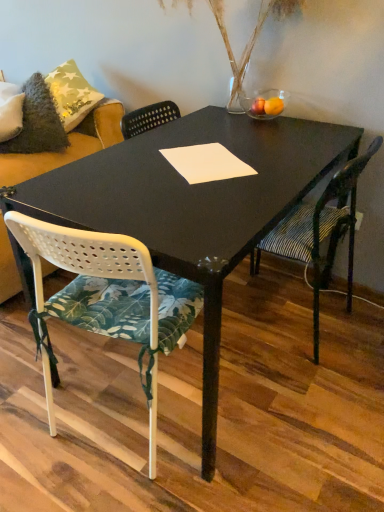
Question: Is striped fabric chair at right, which appears as the 1th chair when viewed from the right, at the right side of white perforated plastic chair at center, which is counted as the 2th chair, starting from the right?

Choices:
 (A) no
 (B) yes

Answer: (B)

Question: Does striped fabric chair at right, which appears as the 1th chair when viewed from the right, have a lesser height compared to white perforated plastic chair at center, which is counted as the 2th chair, starting from the right?

Choices:
 (A) yes
 (B) no

Answer: (A)

Question: Can you confirm if striped fabric chair at right, which appears as the 1th chair when viewed from the right, is thinner than white perforated plastic chair at center, which is counted as the 2th chair, starting from the right?

Choices:
 (A) yes
 (B) no

Answer: (B)

Question: Considering the relative sizes of striped fabric chair at right, the second chair when ordered from left to right, and white perforated plastic chair at center, which is the 1th chair from left to right, in the image provided, is striped fabric chair at right, the second chair when ordered from left to right, bigger than white perforated plastic chair at center, which is the 1th chair from left to right,?

Choices:
 (A) yes
 (B) no

Answer: (B)

Question: Does striped fabric chair at right, which appears as the 1th chair when viewed from the right, touch white perforated plastic chair at center, which is the 1th chair from left to right?

Choices:
 (A) yes
 (B) no

Answer: (B)

Question: From the image's perspective, is striped fabric chair at right, the second chair when ordered from left to right, above white perforated plastic chair at center, which is counted as the 2th chair, starting from the right?

Choices:
 (A) no
 (B) yes

Answer: (B)

Question: From the image's perspective, is striped fabric chair at right, the second chair when ordered from left to right, above translucent glass vase at upper center?

Choices:
 (A) yes
 (B) no

Answer: (B)

Question: Is striped fabric chair at right, the second chair when ordered from left to right, oriented away from translucent glass vase at upper center?

Choices:
 (A) no
 (B) yes

Answer: (A)

Question: Considering the relative positions of striped fabric chair at right, the second chair when ordered from left to right, and translucent glass vase at upper center in the image provided, is striped fabric chair at right, the second chair when ordered from left to right, to the right of translucent glass vase at upper center from the viewer's perspective?

Choices:
 (A) no
 (B) yes

Answer: (B)

Question: Can you confirm if striped fabric chair at right, the second chair when ordered from left to right, is smaller than translucent glass vase at upper center?

Choices:
 (A) no
 (B) yes

Answer: (A)

Question: Does striped fabric chair at right, which appears as the 1th chair when viewed from the right, contain translucent glass vase at upper center?

Choices:
 (A) no
 (B) yes

Answer: (A)

Question: Can you confirm if striped fabric chair at right, the second chair when ordered from left to right, is wider than translucent glass vase at upper center?

Choices:
 (A) no
 (B) yes

Answer: (B)

Question: Is fuzzy gray pillow at upper left positioned far away from white paper at center?

Choices:
 (A) yes
 (B) no

Answer: (B)